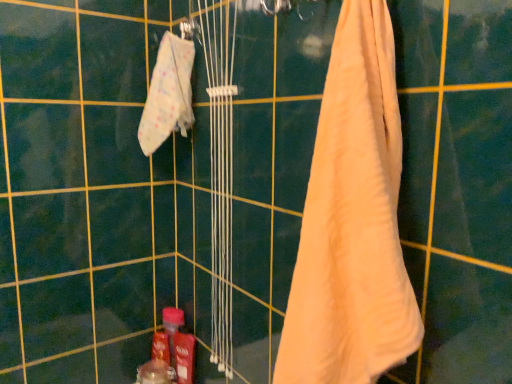
Question: Considering the relative sizes of beige cotton towel at right, which is the second towel in back-to-front order, and white fabric towel at upper left, the 2th towel when ordered from right to left, in the image provided, is beige cotton towel at right, which is the second towel in back-to-front order, taller than white fabric towel at upper left, the 2th towel when ordered from right to left,?

Choices:
 (A) no
 (B) yes

Answer: (B)

Question: Considering the relative sizes of beige cotton towel at right, the 1th towel positioned from the right, and white fabric towel at upper left, positioned as the first towel in left-to-right order, in the image provided, is beige cotton towel at right, the 1th towel positioned from the right, thinner than white fabric towel at upper left, positioned as the first towel in left-to-right order,?

Choices:
 (A) yes
 (B) no

Answer: (A)

Question: From the image's perspective, is beige cotton towel at right, the 1th towel positioned from the right, on white fabric towel at upper left, marked as the 1th towel in a back-to-front arrangement?

Choices:
 (A) yes
 (B) no

Answer: (B)

Question: From a real-world perspective, does beige cotton towel at right, acting as the 1th towel starting from the front, stand above white fabric towel at upper left, positioned as the first towel in left-to-right order?

Choices:
 (A) no
 (B) yes

Answer: (A)

Question: Can you confirm if beige cotton towel at right, which is the second towel in back-to-front order, is wider than white fabric towel at upper left, positioned as the first towel in left-to-right order?

Choices:
 (A) yes
 (B) no

Answer: (B)

Question: Is white fabric towel at upper left, which is the second towel from front to back, inside beige cotton towel at right, the 1th towel positioned from the right?

Choices:
 (A) yes
 (B) no

Answer: (B)

Question: Can you confirm if white fabric towel at upper left, which is the second towel from front to back, is smaller than beige cotton towel at right, which is the 2th towel from left to right?

Choices:
 (A) no
 (B) yes

Answer: (B)

Question: Is white fabric towel at upper left, which is the second towel from front to back, in front of beige cotton towel at right, which is the second towel in back-to-front order?

Choices:
 (A) no
 (B) yes

Answer: (A)

Question: Is white fabric towel at upper left, which is the second towel from front to back, outside beige cotton towel at right, which is the 2th towel from left to right?

Choices:
 (A) no
 (B) yes

Answer: (B)

Question: Is the position of white fabric towel at upper left, positioned as the first towel in left-to-right order, more distant than that of beige cotton towel at right, acting as the 1th towel starting from the front?

Choices:
 (A) yes
 (B) no

Answer: (A)

Question: Does white fabric towel at upper left, marked as the 1th towel in a back-to-front arrangement, turn towards beige cotton towel at right, which is the 2th towel from left to right?

Choices:
 (A) yes
 (B) no

Answer: (B)

Question: Considering the relative positions of white fabric towel at upper left, which is the second towel from front to back, and beige cotton towel at right, which is the 2th towel from left to right, in the image provided, is white fabric towel at upper left, which is the second towel from front to back, to the right of beige cotton towel at right, which is the 2th towel from left to right, from the viewer's perspective?

Choices:
 (A) yes
 (B) no

Answer: (B)

Question: From a real-world perspective, is translucent plastic bottle at lower center positioned under white fabric towel at upper left, positioned as the first towel in left-to-right order, based on gravity?

Choices:
 (A) yes
 (B) no

Answer: (A)